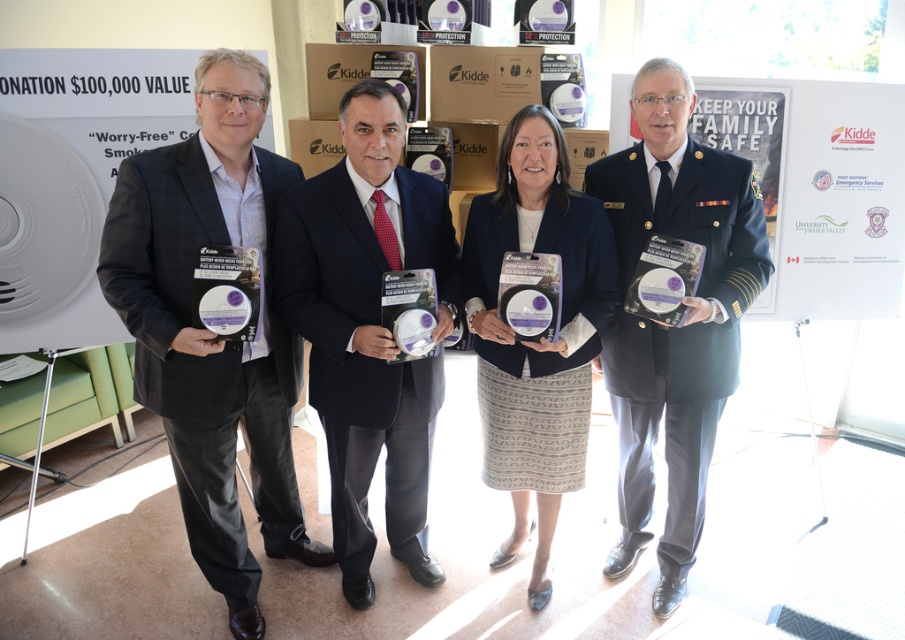
Question: Which of the following is the farthest from the observer?

Choices:
 (A) (643, 419)
 (B) (225, 525)

Answer: (A)

Question: Can you confirm if matte black suit at left is bigger than patterned fabric skirt at center?

Choices:
 (A) yes
 (B) no

Answer: (A)

Question: Considering the relative positions of navy blue suit at center and patterned fabric skirt at center in the image provided, where is navy blue suit at center located with respect to patterned fabric skirt at center?

Choices:
 (A) right
 (B) left

Answer: (B)

Question: Which object is the farthest from the matte black suit at left?

Choices:
 (A) navy blue suit at center
 (B) dark blue uniform at center

Answer: (B)

Question: Among these objects, which one is farthest from the camera?

Choices:
 (A) dark blue uniform at center
 (B) matte black suit at left

Answer: (A)

Question: Does dark blue uniform at center have a larger size compared to patterned fabric skirt at center?

Choices:
 (A) yes
 (B) no

Answer: (A)